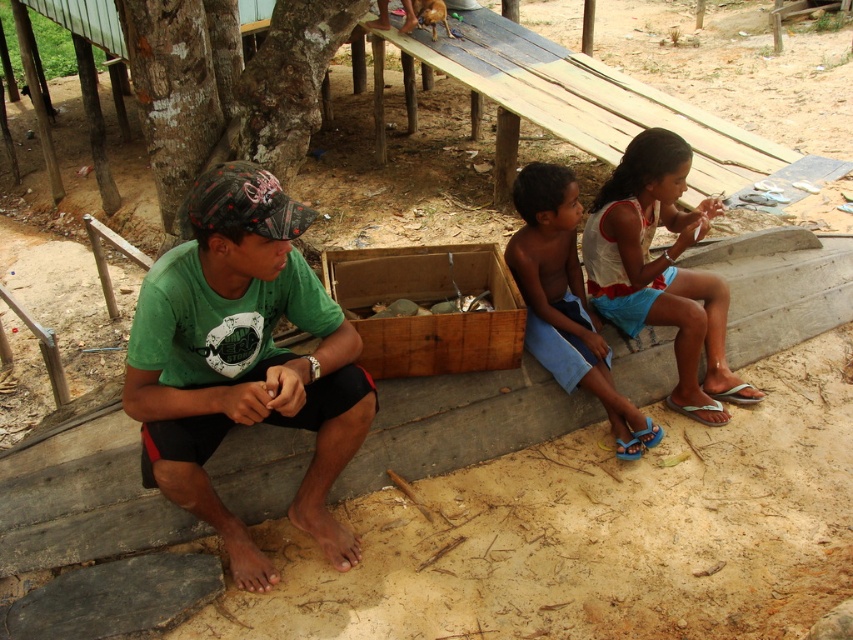
You are trying to decide which shirt to wear for a day at the beach. Both the green fabric shirt at center and the white cotton shirt at center are available. If you want a wider shirt, which one should you choose?

The white cotton shirt at center is wider than the green fabric shirt at center, so you should choose the white cotton shirt at center for a wider option.

You are a photographer trying to capture a candid shot of the two children sitting at the center. You notice the white cotton shirt at center and the blue fabric shorts at center. Which clothing item is positioned higher relative to the other?

The white cotton shirt at center is located above the blue fabric shorts at center, so the white cotton shirt at center is positioned higher.